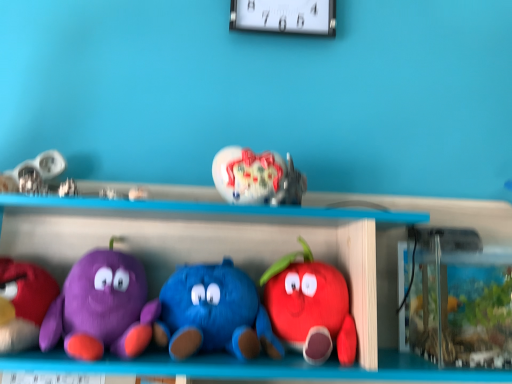
Question: From the image's perspective, relative to blue plush toy at center, marked as the third toy in a right-to-left arrangement, is white plastic clock at upper center above or below?

Choices:
 (A) above
 (B) below

Answer: (A)

Question: Considering the positions of point (244, 4) and point (169, 302), is point (244, 4) closer or farther from the camera than point (169, 302)?

Choices:
 (A) closer
 (B) farther

Answer: (B)

Question: Estimate the real-world distances between objects in this image. Which object is farther from the matte purple plush at left, which is counted as the 5th toy, starting from the right?

Choices:
 (A) white plastic clock at upper center
 (B) purple plush toy at left, which is the 1th toy in left-to-right order
 (C) blue plush toy at center, which ranks as the fourth toy in left-to-right order
 (D) shiny glass vase at center, which is the second toy in right-to-left order
 (E) satin silver toy at upper center, arranged as the 4th toy when viewed from the right

Answer: (A)

Question: Which of these objects is positioned closest to the matte purple plush at left, which is counted as the 5th toy, starting from the right?

Choices:
 (A) blue plush toy at center, which ranks as the fourth toy in left-to-right order
 (B) purple plush toy at left, which is the 1th toy in left-to-right order
 (C) satin silver toy at upper center, which ranks as the 3th toy in left-to-right order
 (D) matte plush apple at center, the first toy when ordered from right to left
 (E) shiny glass vase at center, which is the second toy in right-to-left order

Answer: (B)